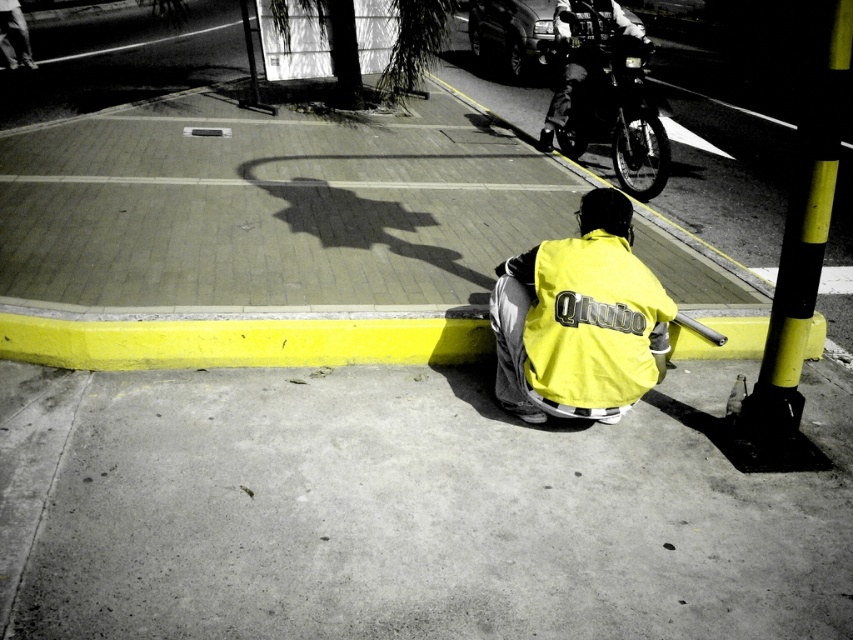
How distant is yellow painted curb at lower center from yellow/black striped pole at right?

The distance of yellow painted curb at lower center from yellow/black striped pole at right is 6.03 feet.

Is point (312, 316) positioned in front of point (813, 161)?

No, (312, 316) is further to viewer.

In the scene shown: Who is more distant from viewer, [177,346] or [830,42]?

Positioned behind is point [177,346].

You are a GUI agent. You are given a task and a screenshot of the screen. Output one action in this format:
    pyautogui.click(x=<x>, y=<y>)
    Task: Click on the yellow painted curb at lower center
    Image resolution: width=853 pixels, height=640 pixels.
    Given the screenshot: What is the action you would take?
    pyautogui.click(x=241, y=336)

Does yellow/black striped pole at right have a greater height compared to black matte motorcycle at upper right?

In fact, yellow/black striped pole at right may be shorter than black matte motorcycle at upper right.

Between yellow/black striped pole at right and black matte motorcycle at upper right, which one has more height?

Standing taller between the two is black matte motorcycle at upper right.

Who is more distant from viewer, (825, 228) or (560, 109)?

Point (560, 109)

Locate an element on the screen. yellow/black striped pole at right is located at coordinates [799, 243].

Between yellow painted curb at lower center and black matte motorcycle at upper right, which one appears on the left side from the viewer's perspective?

yellow painted curb at lower center is more to the left.

This screenshot has width=853, height=640. I want to click on yellow painted curb at lower center, so click(241, 336).

Is point (230, 330) closer to viewer compared to point (548, 148)?

That is True.

You are a GUI agent. You are given a task and a screenshot of the screen. Output one action in this format:
    pyautogui.click(x=<x>, y=<y>)
    Task: Click on the yellow painted curb at lower center
    
    Given the screenshot: What is the action you would take?
    pyautogui.click(x=241, y=336)